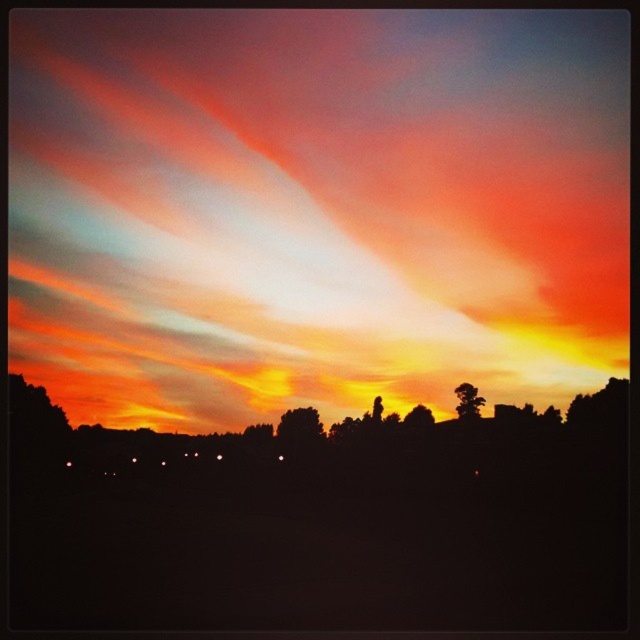
Question: Considering the real-world distances, which object is closest to the green leafy tree at center?

Choices:
 (A) brown textured tree at upper right
 (B) silky brown tree at center
 (C) translucent orange cloud at upper center

Answer: (B)

Question: Among these points, which one is nearest to the camera?

Choices:
 (A) click(x=282, y=422)
 (B) click(x=406, y=426)
 (C) click(x=320, y=48)
 (D) click(x=460, y=404)

Answer: (C)

Question: Considering the real-world distances, which object is farthest from the brown textured tree at upper right?

Choices:
 (A) translucent orange cloud at upper center
 (B) silky brown tree at center

Answer: (A)

Question: In this image, where is translucent orange cloud at upper center located relative to green leafy tree at center?

Choices:
 (A) above
 (B) below

Answer: (A)

Question: Is brown textured tree at upper right below silky brown tree at center?

Choices:
 (A) no
 (B) yes

Answer: (A)

Question: Observing the image, what is the correct spatial positioning of translucent orange cloud at upper center in reference to silky brown tree at center?

Choices:
 (A) right
 (B) left

Answer: (B)